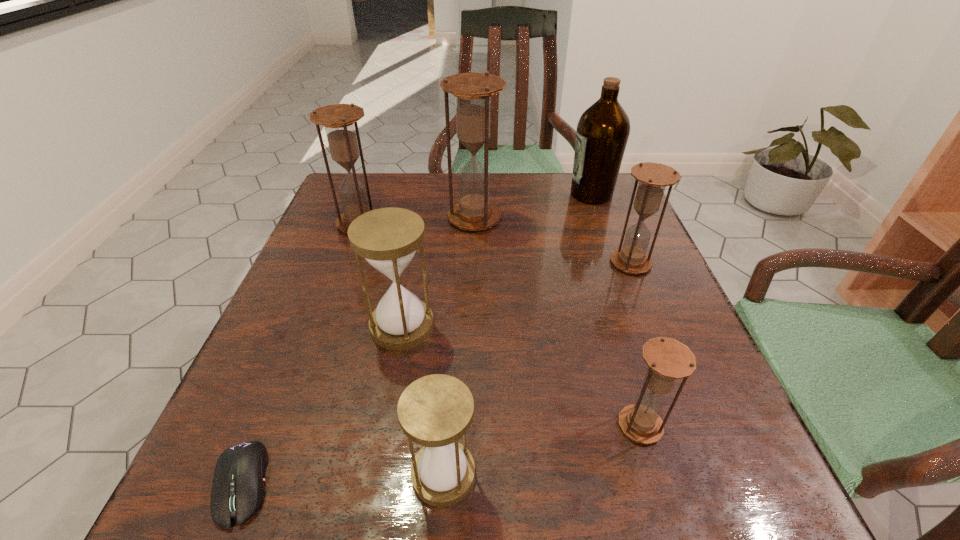
The image size is (960, 540). Identify the location of the tallest hourglass. (472, 91).

Image resolution: width=960 pixels, height=540 pixels. I want to click on the biggest brown hourglass, so click(x=472, y=91).

You are a GUI agent. You are given a task and a screenshot of the screen. Output one action in this format:
    pyautogui.click(x=<x>, y=<y>)
    Task: Click on the olive oil
    This screenshot has width=960, height=540.
    Given the screenshot: What is the action you would take?
    pyautogui.click(x=602, y=133)

You are a GUI agent. You are given a task and a screenshot of the screen. Output one action in this format:
    pyautogui.click(x=<x>, y=<y>)
    Task: Click on the leftmost brown hourglass
    
    Given the screenshot: What is the action you would take?
    pyautogui.click(x=339, y=119)

Find the location of a particular element. The width and height of the screenshot is (960, 540). the leftmost hourglass is located at coordinates (339, 119).

At what (x,y) coordinates should I click in order to perform the action: click on the fourth farthest object. Please return your answer as a coordinate pair (x, y). The image size is (960, 540). Looking at the image, I should click on (653, 178).

Find the location of a particular element. the second smallest brown hourglass is located at coordinates (653, 178).

I want to click on the bigger white hourglass, so click(387, 238).

The height and width of the screenshot is (540, 960). I want to click on the fourth nearest object, so click(387, 238).

The width and height of the screenshot is (960, 540). I want to click on the fifth hourglass from left to right, so click(x=667, y=359).